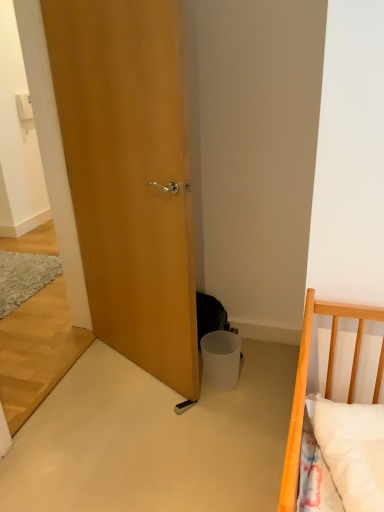
At what (x,y) coordinates should I click in order to perform the action: click on wooden door at center. Please return your answer as a coordinate pair (x, y). The width and height of the screenshot is (384, 512). Looking at the image, I should click on (129, 175).

This screenshot has width=384, height=512. What do you see at coordinates (129, 175) in the screenshot?
I see `wooden door at center` at bounding box center [129, 175].

Measure the distance between point (90, 4) and camera.

Point (90, 4) and camera are 5.35 feet apart.

Locate an element on the screen. The image size is (384, 512). white matte trash bin at lower center is located at coordinates (221, 359).

The height and width of the screenshot is (512, 384). Describe the element at coordinates (221, 359) in the screenshot. I see `white matte trash bin at lower center` at that location.

Where is `wooden door at center`? The image size is (384, 512). wooden door at center is located at coordinates (129, 175).

Considering the relative positions of white matte trash bin at lower center and wooden door at center in the image provided, is white matte trash bin at lower center to the right of wooden door at center from the viewer's perspective?

Yes.

Considering the positions of objects white matte trash bin at lower center and wooden door at center in the image provided, who is in front, white matte trash bin at lower center or wooden door at center?

wooden door at center.

Is point (204, 369) closer to viewer compared to point (164, 204)?

That is False.

From the image's perspective, is white matte trash bin at lower center beneath wooden door at center?

Yes.

From a real-world perspective, is white matte trash bin at lower center positioned under wooden door at center based on gravity?

Yes.

Can you confirm if white matte trash bin at lower center is wider than wooden door at center?

Yes, white matte trash bin at lower center is wider than wooden door at center.

Considering the relative sizes of white matte trash bin at lower center and wooden door at center in the image provided, is white matte trash bin at lower center shorter than wooden door at center?

Yes.

Consider the image. Between white matte trash bin at lower center and wooden door at center, which one has smaller size?

white matte trash bin at lower center is smaller.

Based on the photo, is white matte trash bin at lower center not inside wooden door at center?

Yes, white matte trash bin at lower center is outside of wooden door at center.

Would you consider white matte trash bin at lower center to be distant from wooden door at center?

No, white matte trash bin at lower center is not far from wooden door at center.

Is white matte trash bin at lower center turned away from wooden door at center?

No, white matte trash bin at lower center is not facing the opposite direction of wooden door at center.

How many degrees apart are the facing directions of white matte trash bin at lower center and wooden door at center?

The angular difference between white matte trash bin at lower center and wooden door at center is 27.7 degrees.

Where is `trash bin/can behind the wooden door at center`? trash bin/can behind the wooden door at center is located at coordinates (221, 359).

Based on the photo, can you confirm if wooden door at center is positioned to the right of white matte trash bin at lower center?

No.

Is the position of wooden door at center more distant than that of white matte trash bin at lower center?

No, wooden door at center is in front of white matte trash bin at lower center.

Considering the positions of point (82, 214) and point (216, 377), is point (82, 214) closer or farther from the camera than point (216, 377)?

Point (82, 214) appears to be farther away from the viewer than point (216, 377).

From the image's perspective, which is above, wooden door at center or white matte trash bin at lower center?

wooden door at center appears higher in the image.

From a real-world perspective, is wooden door at center positioned over white matte trash bin at lower center based on gravity?

Yes, from a real-world perspective, wooden door at center is on top of white matte trash bin at lower center.

Between wooden door at center and white matte trash bin at lower center, which one has larger width?

Wider between the two is white matte trash bin at lower center.

Is wooden door at center taller or shorter than white matte trash bin at lower center?

Considering their sizes, wooden door at center has more height than white matte trash bin at lower center.

Considering the relative sizes of wooden door at center and white matte trash bin at lower center in the image provided, is wooden door at center smaller than white matte trash bin at lower center?

Incorrect, wooden door at center is not smaller in size than white matte trash bin at lower center.

Is wooden door at center inside the boundaries of white matte trash bin at lower center, or outside?

wooden door at center is spatially situated outside white matte trash bin at lower center.

Would you consider wooden door at center to be distant from white matte trash bin at lower center?

No, wooden door at center is not far away from white matte trash bin at lower center.

Is wooden door at center aimed at white matte trash bin at lower center?

No, wooden door at center is not facing towards white matte trash bin at lower center.

Measure the distance between wooden door at center and white matte trash bin at lower center.

wooden door at center is 25.54 inches from white matte trash bin at lower center.

In order to click on trash bin/can located on the right of wooden door at center in this screenshot , I will do `click(221, 359)`.

Locate an element on the screen. door that appears above the white matte trash bin at lower center (from the image's perspective) is located at coordinates (129, 175).

Where is `trash bin/can behind the wooden door at center`? trash bin/can behind the wooden door at center is located at coordinates (221, 359).